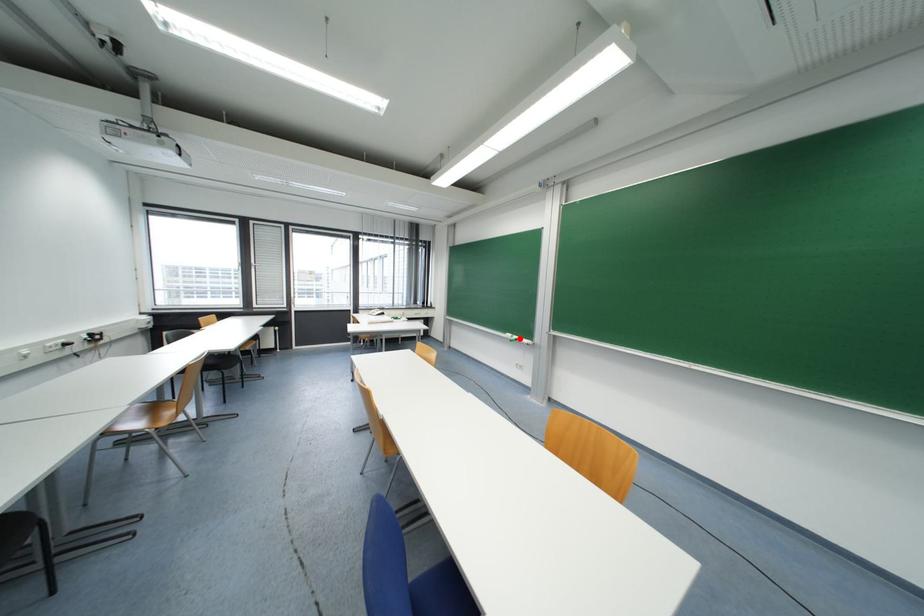
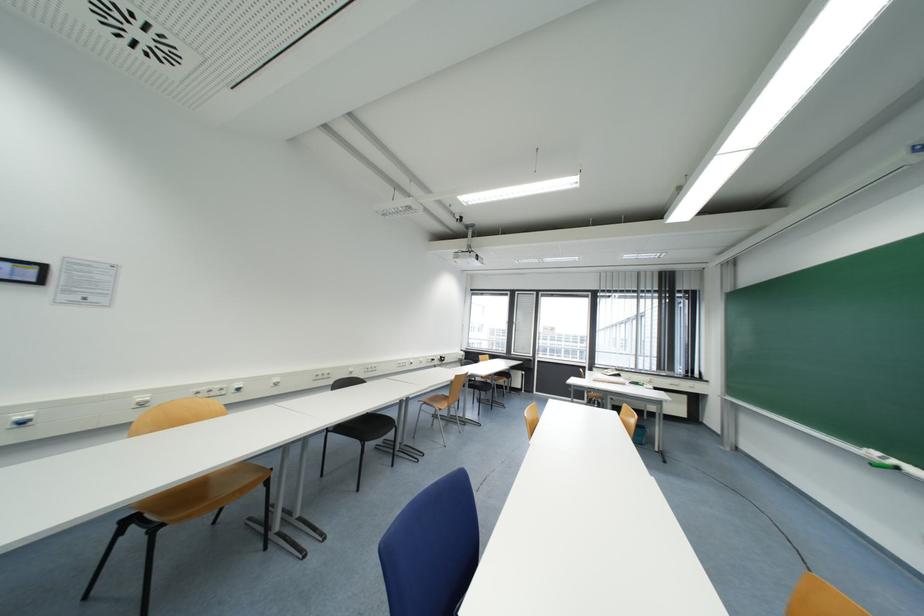
Locate, in the second image, the point that corresponds to the highlighted location in the first image.

(898, 464)